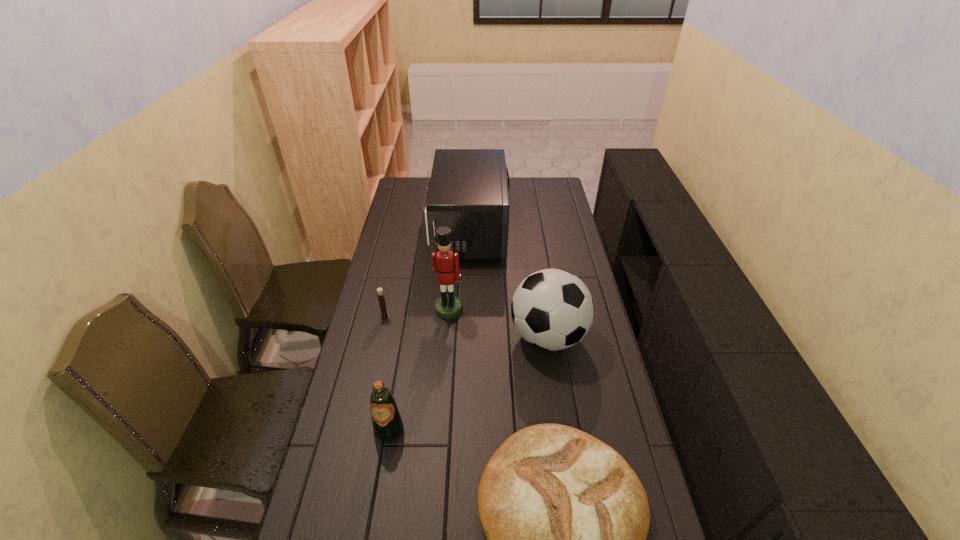
The image size is (960, 540). Identify the location of free spot located 0.270m on the back of the leftmost object. pos(396,266).

At what (x,y) coordinates should I click in order to perform the action: click on olive oil located at the left edge. Please return your answer as a coordinate pair (x, y). Looking at the image, I should click on (387, 424).

Identify the location of candle holder that is positioned at the left edge. The image size is (960, 540). (380, 293).

This screenshot has height=540, width=960. Identify the location of object located at the right edge. (552, 309).

Locate an element on the screen. vacant space at the left edge of the desktop is located at coordinates (411, 274).

In order to click on vacant space at the right edge of the desktop in this screenshot , I will do `click(574, 259)`.

This screenshot has width=960, height=540. In order to click on free location at the far right corner of the desktop in this screenshot , I will do [x=547, y=196].

This screenshot has height=540, width=960. Identify the location of blank region between the soccer ball and the tallest object. (x=498, y=323).

Identify the location of vacant point located between the nutcracker and the leftmost object. (417, 313).

Find the location of `vacant area that lies between the leftmost object and the nutcracker`. vacant area that lies between the leftmost object and the nutcracker is located at coordinates [x=417, y=313].